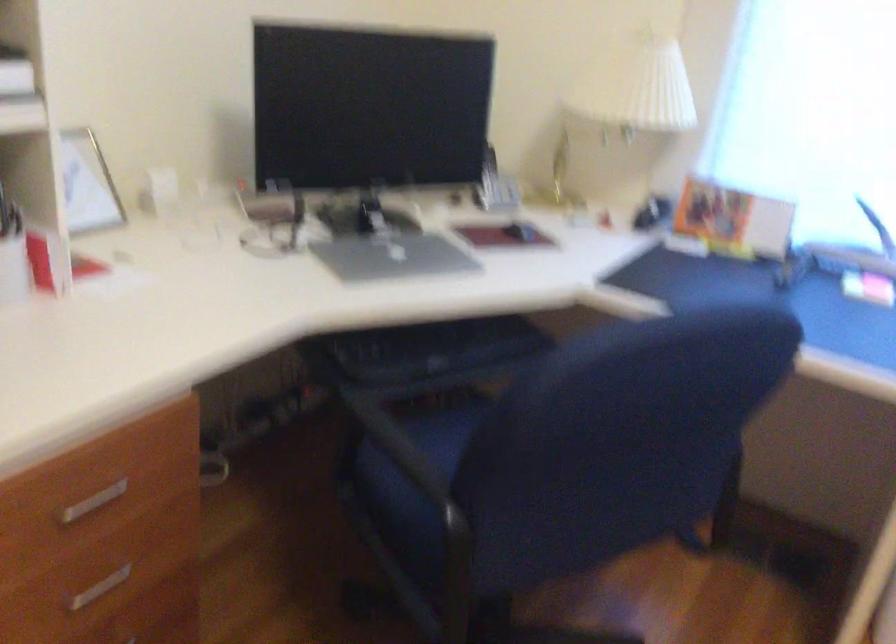
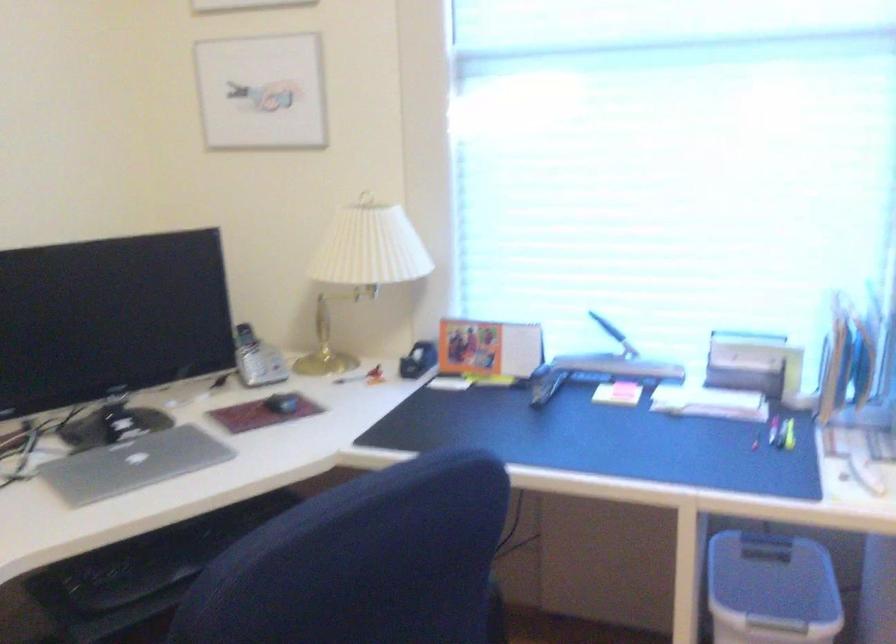
Question: The images are taken continuously from a first-person perspective. In which direction are you moving?

Choices:
 (A) Left
 (B) Right
 (C) Forward
 (D) Backward

Answer: (B)